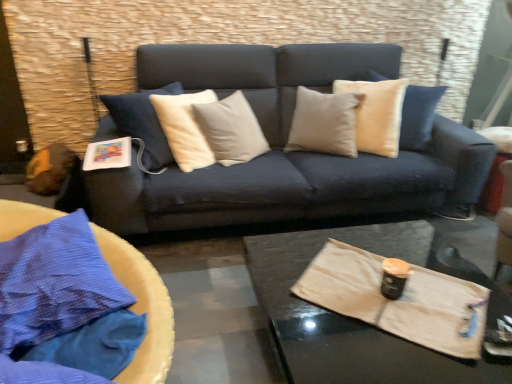
The image size is (512, 384). What do you see at coordinates (142, 308) in the screenshot?
I see `blue fabric at left` at bounding box center [142, 308].

You are a GUI agent. You are given a task and a screenshot of the screen. Output one action in this format:
    pyautogui.click(x=<x>, y=<y>)
    Task: Click on the wooden tray at center
    
    Given the screenshot: What is the action you would take?
    pyautogui.click(x=366, y=323)

Where is `blue fabric at left`? The width and height of the screenshot is (512, 384). blue fabric at left is located at coordinates (142, 308).

Considering the positions of objects black matte can at center and wooden tray at center in the image provided, who is behind, black matte can at center or wooden tray at center?

black matte can at center.

Considering the sizes of objects black matte can at center and wooden tray at center in the image provided, who is taller, black matte can at center or wooden tray at center?

With more height is wooden tray at center.

Which is closer to the camera, (x=393, y=267) or (x=335, y=316)?

Point (x=393, y=267) appears to be farther away from the viewer than point (x=335, y=316).

From the image's perspective, is black matte can at center positioned above or below wooden tray at center?

From the image's perspective, black matte can at center appears above wooden tray at center.

Is wooden tray at center wider than blue fabric at left?

Correct, the width of wooden tray at center exceeds that of blue fabric at left.

From the image's perspective, is wooden tray at center located beneath blue fabric at left?

Yes.

There is a wooden tray at center. Identify the location of round table above it (from a real-world perspective). (142, 308).

Are wooden tray at center and blue fabric at left making contact?

No, wooden tray at center is not with blue fabric at left.

Would you consider blue fabric at left to be distant from black matte can at center?

blue fabric at left is actually quite close to black matte can at center.

Does blue fabric at left come in front of black matte can at center?

Yes, it is in front of black matte can at center.

Locate an element on the screen. round table to the left of black matte can at center is located at coordinates (142, 308).

How far apart are blue fabric at left and black matte can at center?

38.98 inches.

Is the surface of wooden tray at center in direct contact with black matte can at center?

They are not placed beside each other.

Is wooden tray at center facing towards black matte can at center?

No.

Is wooden tray at center thinner than black matte can at center?

In fact, wooden tray at center might be wider than black matte can at center.

Does black matte can at center turn towards blue fabric at left?

No, black matte can at center is not turned towards blue fabric at left.

From a real-world perspective, which object stands above the other?

In real-world perspective, blue fabric at left is above.

The width and height of the screenshot is (512, 384). I want to click on round table in front of the black matte can at center, so (x=142, y=308).

Based on their positions, is black matte can at center located to the left or right of blue fabric at left?

Clearly, black matte can at center is on the right of blue fabric at left in the image.

The width and height of the screenshot is (512, 384). I want to click on coffee table that is on the right side of blue fabric at left, so click(366, 323).

Does blue fabric at left lie behind wooden tray at center?

No, blue fabric at left is closer to the camera.

Is blue fabric at left at the left side of wooden tray at center?

Yes.

Find the location of a particular element. The height and width of the screenshot is (384, 512). beverage that is above the wooden tray at center (from the image's perspective) is located at coordinates (394, 278).

I want to click on coffee table that appears below the blue fabric at left (from a real-world perspective), so click(366, 323).

Which object lies nearer to the anchor point black matte can at center, wooden tray at center or blue fabric at left?

wooden tray at center.

Considering their positions, is blue fabric at left positioned further to black matte can at center than wooden tray at center?

Based on the image, blue fabric at left appears to be further to black matte can at center.

Consider the image. From the image, which object appears to be nearer to wooden tray at center, blue fabric at left or black matte can at center?

black matte can at center is closer to wooden tray at center.

From the image, which object appears to be nearer to wooden tray at center, black matte can at center or blue fabric at left?

black matte can at center is closer to wooden tray at center.

Based on their spatial positions, is black matte can at center or wooden tray at center further from blue fabric at left?

black matte can at center is further to blue fabric at left.

Looking at the image, which one is located closer to blue fabric at left, wooden tray at center or black matte can at center?

Among the two, wooden tray at center is located nearer to blue fabric at left.

Where is `coffee table situated between blue fabric at left and black matte can at center from left to right`? The width and height of the screenshot is (512, 384). coffee table situated between blue fabric at left and black matte can at center from left to right is located at coordinates (366, 323).